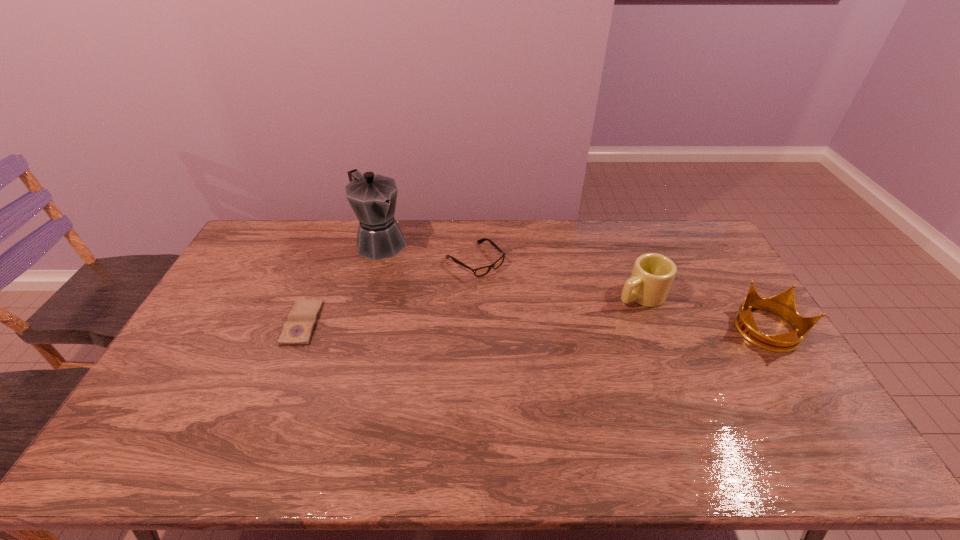
This screenshot has width=960, height=540. I want to click on the shortest object, so click(x=297, y=330).

You are a GUI agent. You are given a task and a screenshot of the screen. Output one action in this format:
    pyautogui.click(x=<x>, y=<y>)
    Task: Click on the diary
    
    Given the screenshot: What is the action you would take?
    pyautogui.click(x=297, y=330)

Where is `the rightmost object`? Image resolution: width=960 pixels, height=540 pixels. the rightmost object is located at coordinates (783, 304).

Locate an element on the screen. This screenshot has width=960, height=540. the second object from right to left is located at coordinates pyautogui.click(x=652, y=276).

Locate an element on the screen. the third object from left to right is located at coordinates (479, 272).

Where is `the second shortest object`? the second shortest object is located at coordinates (479, 272).

Locate an element on the screen. The height and width of the screenshot is (540, 960). the fourth object from right to left is located at coordinates (372, 197).

This screenshot has height=540, width=960. Find the location of `coffeepot`. coffeepot is located at coordinates (372, 197).

Locate an element on the screen. vacant region located on the right of the shortest object is located at coordinates (391, 323).

What are the coordinates of `vacant space situated on the left of the crown` in the screenshot? It's located at (681, 330).